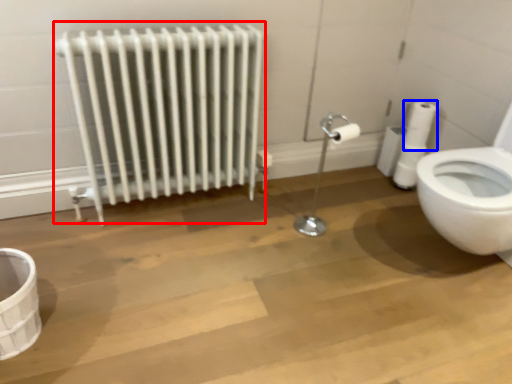
Question: Among these objects, which one is nearest to the camera, radiator (highlighted by a red box) or toilet paper (highlighted by a blue box)?

Choices:
 (A) radiator
 (B) toilet paper

Answer: (A)